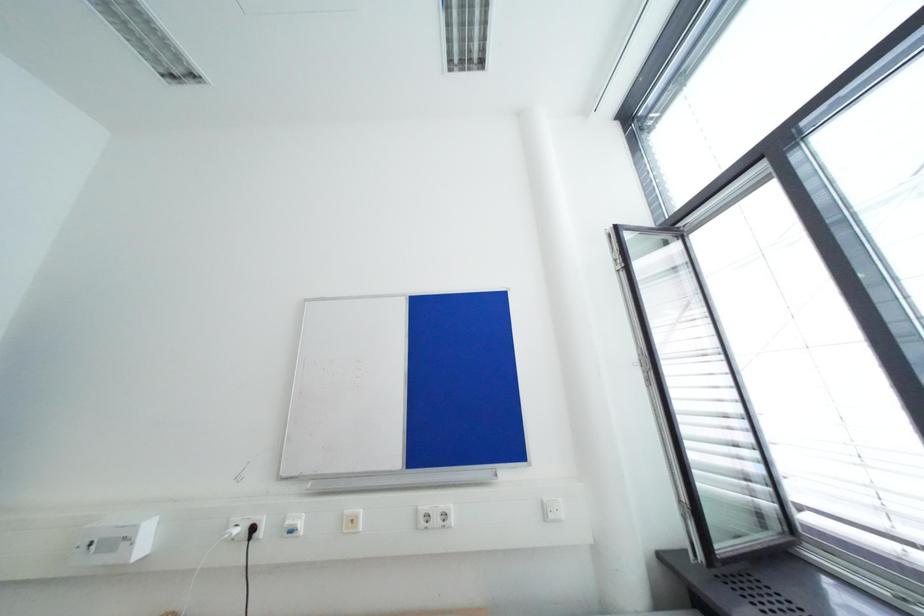
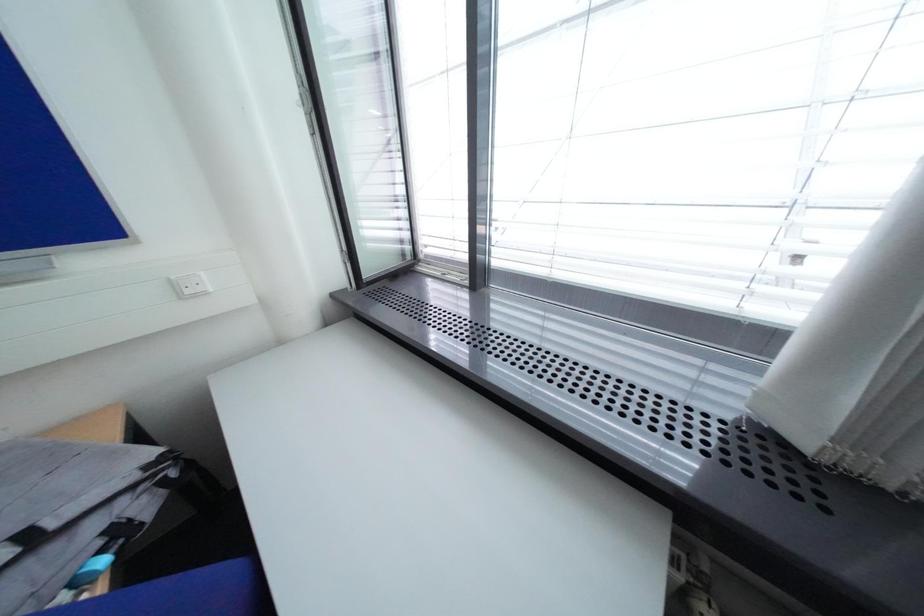
Based on the continuous images, in which direction is the camera rotating?

The rotation direction of the camera is right-down.